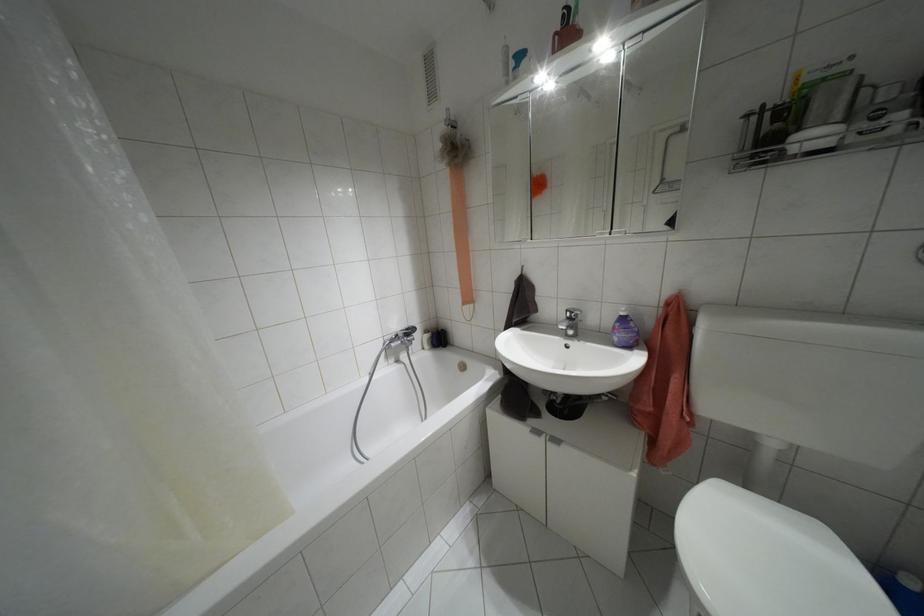
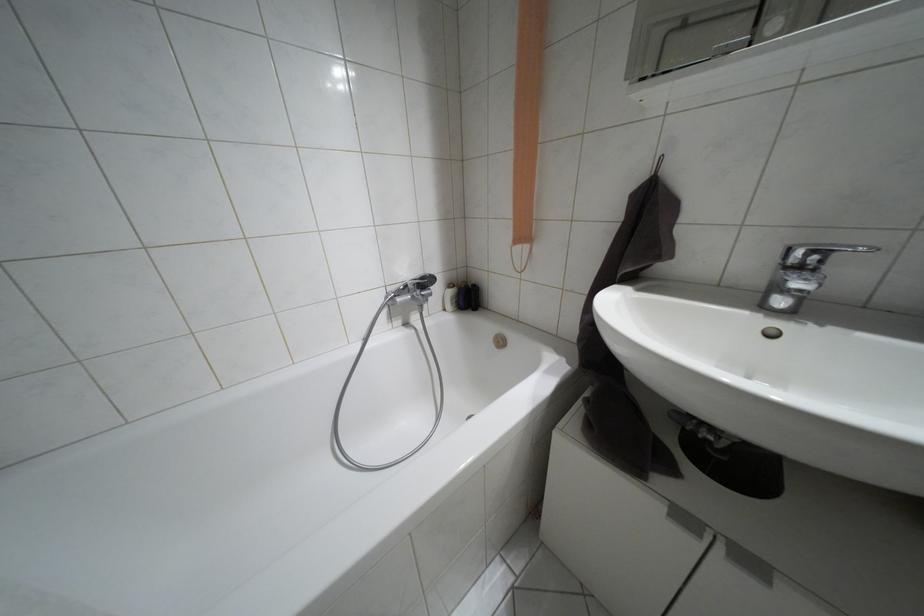
Locate, in the second image, the point that corresponds to (x=426, y=331) in the first image.

(448, 285)